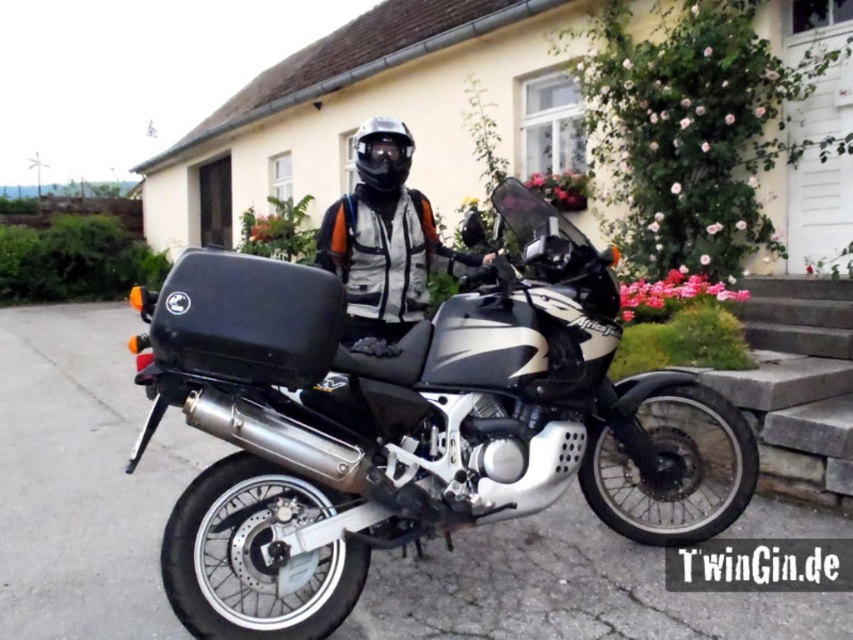
You are a delivery person who needs to secure a package on the silver metallic motorcycle at center. However, you are wearing the transparent plastic goggles at center. Can you see the motorcycle clearly through the goggles?

The silver metallic motorcycle at center is in front of transparent plastic goggles at center, so the goggles are positioned behind the motorcycle. This means the goggles are not obstructing your view, allowing you to see the motorcycle clearly.

You are a photographer standing at the camera position. You want to take a closeup photo of the black matte helmet at center. Considering the distance between you and the helmet, is it possible to capture the helmet in focus without moving closer?

The distance between the black matte helmet at center and the camera is 6.29 feet. This distance is manageable for a photographer to capture the black matte helmet at center in focus using appropriate lens settings, so yes, it is possible without moving closer.

You are a photographer standing at the origin point of the image coordinate system. You want to take a photo of the black matte helmet at center. What are the coordinates where you should aim your camera?

The coordinates where you should aim your camera are at point (381,152).